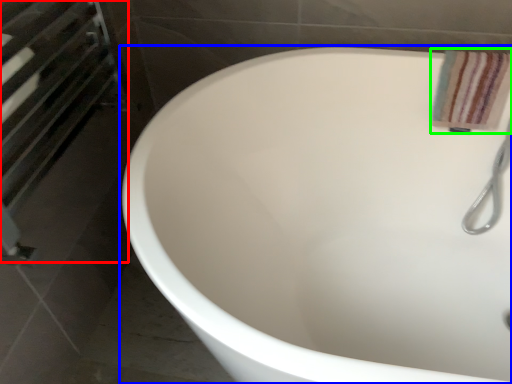
Question: Which is farther away from screen door (highlighted by a red box)? bathtub (highlighted by a blue box) or bath towel (highlighted by a green box)?

Choices:
 (A) bathtub
 (B) bath towel

Answer: (B)